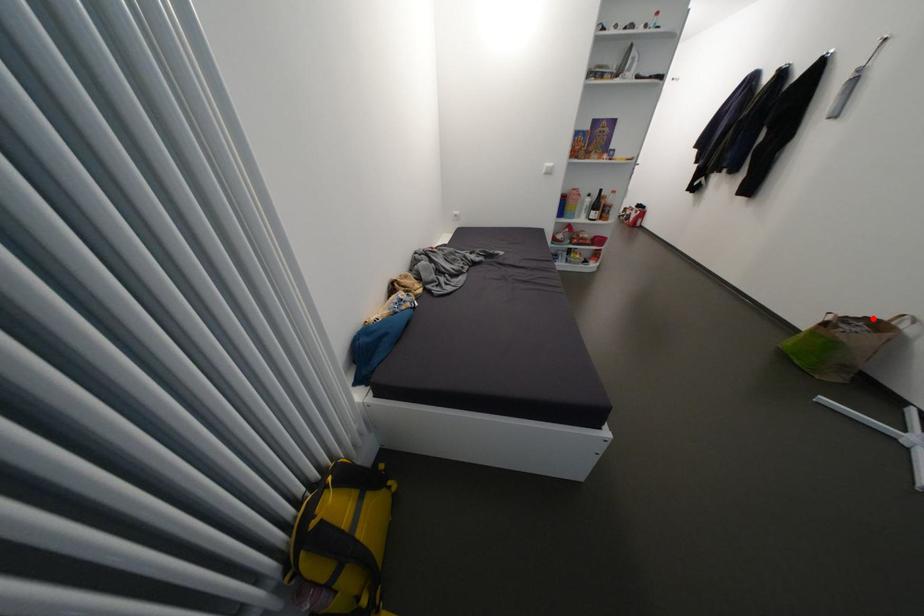
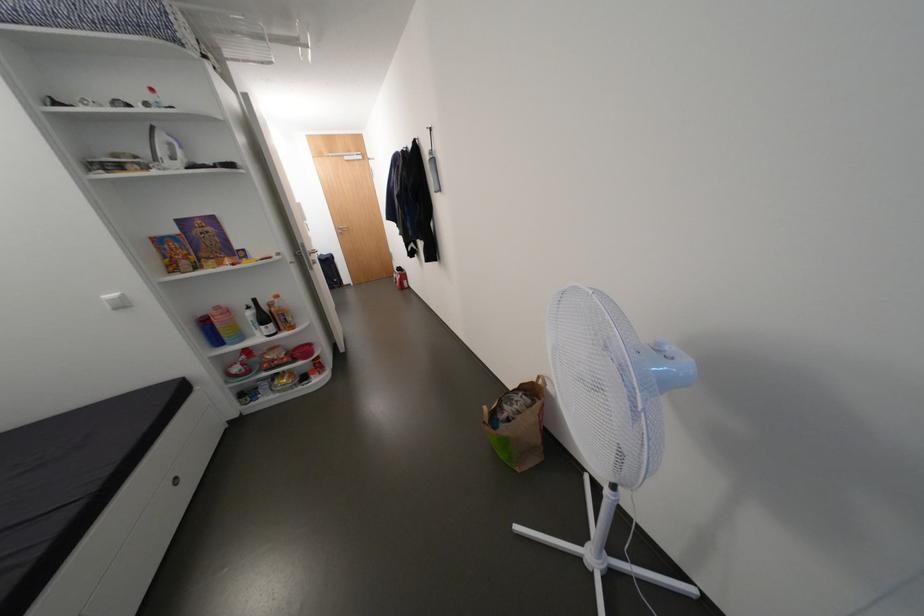
Question: I am providing you with two images of the same scene from different viewpoints. In image1, a red point is highlighted. Considering the same 3D point in image2, which of the following is correct?

Choices:
 (A) It is closer
 (B) It is farther

Answer: (A)